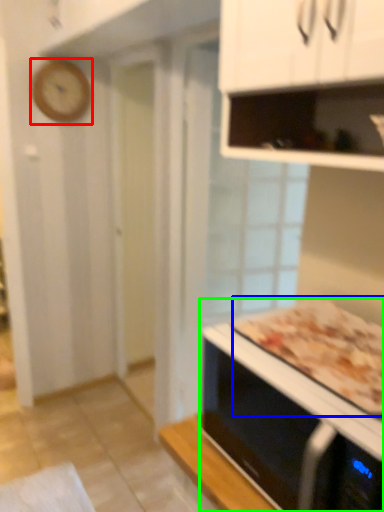
Question: Which object is the closest to the clock (highlighted by a red box)? Choose among these: pizza (highlighted by a blue box) or microwave oven (highlighted by a green box).

Choices:
 (A) pizza
 (B) microwave oven

Answer: (A)